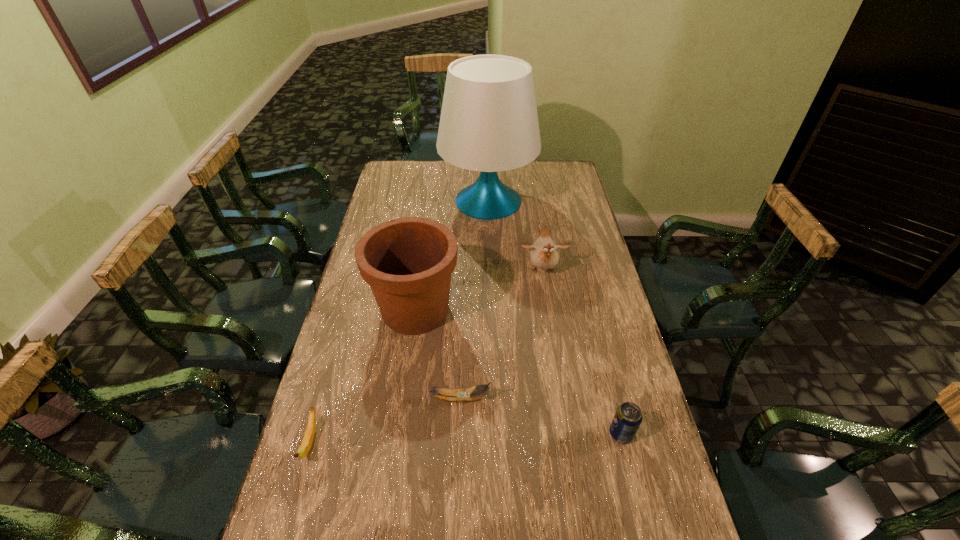
Image resolution: width=960 pixels, height=540 pixels. Identify the location of bird situated at the right edge. (543, 254).

The image size is (960, 540). I want to click on soda that is at the right edge, so click(628, 416).

Identify the location of free spot at the far edge of the desktop. tap(420, 176).

This screenshot has width=960, height=540. I want to click on free point at the left edge, so click(x=382, y=219).

Identify the location of free spot at the right edge of the desktop. (623, 346).

This screenshot has height=540, width=960. Identify the location of vacant space at the far left corner of the desktop. (392, 172).

Identify the location of free spot between the fourth tallest object and the taller banana. (540, 416).

Locate an element on the screen. Image resolution: width=960 pixels, height=540 pixels. free spot between the shortest object and the fourth shortest object is located at coordinates (426, 357).

I want to click on free spot between the flowerpot and the fourth shortest object, so click(x=479, y=291).

At what (x,y) coordinates should I click in order to perform the action: click on free space between the shorter banana and the third tallest object. Please return your answer as a coordinate pair (x, y). The width and height of the screenshot is (960, 540). Looking at the image, I should click on (426, 357).